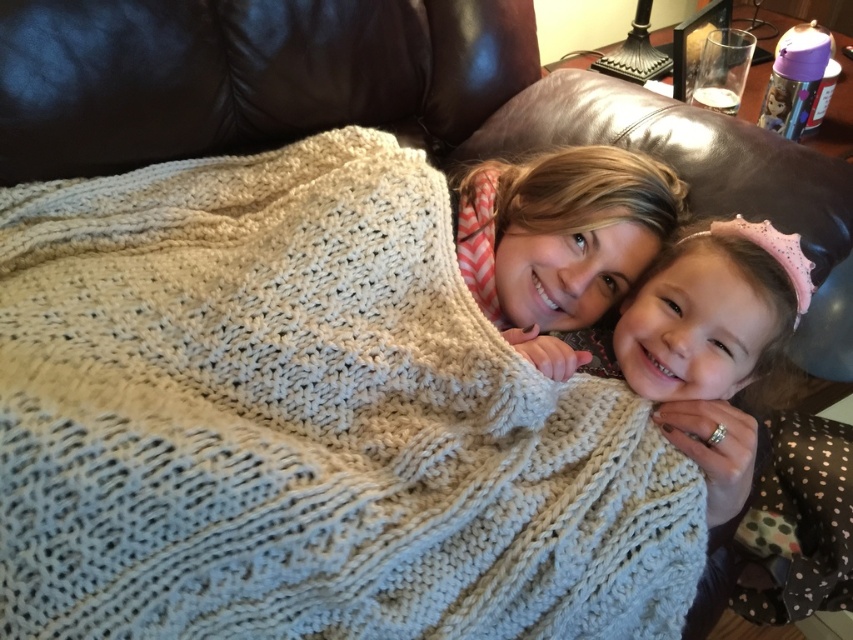
Question: Is knitted wool blanket at center positioned behind chevron scarf at center?

Choices:
 (A) yes
 (B) no

Answer: (B)

Question: From the image, what is the correct spatial relationship of knitted wool blanket at center in relation to polka dot dress at center?

Choices:
 (A) above
 (B) below

Answer: (A)

Question: Is knitted wool blanket at center to the right of chevron scarf at center from the viewer's perspective?

Choices:
 (A) no
 (B) yes

Answer: (A)

Question: Which object is the closest to the knitted wool blanket at center?

Choices:
 (A) chevron scarf at center
 (B) polka dot dress at center

Answer: (A)

Question: Which of the following is the farthest from the observer?

Choices:
 (A) chevron scarf at center
 (B) knitted wool blanket at center

Answer: (A)

Question: Among these objects, which one is farthest from the camera?

Choices:
 (A) knitted wool blanket at center
 (B) polka dot dress at center
 (C) chevron scarf at center

Answer: (C)